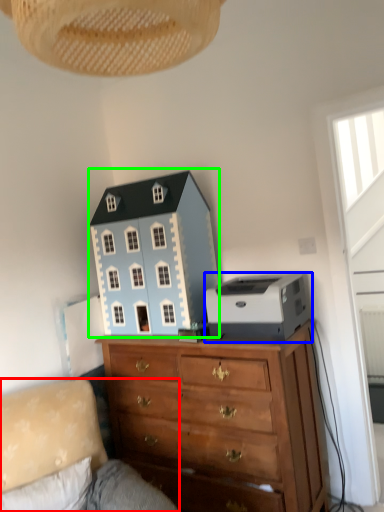
Question: Which is farther away from studio couch (highlighted by a red box)? printer (highlighted by a blue box) or toy (highlighted by a green box)?

Choices:
 (A) printer
 (B) toy

Answer: (A)